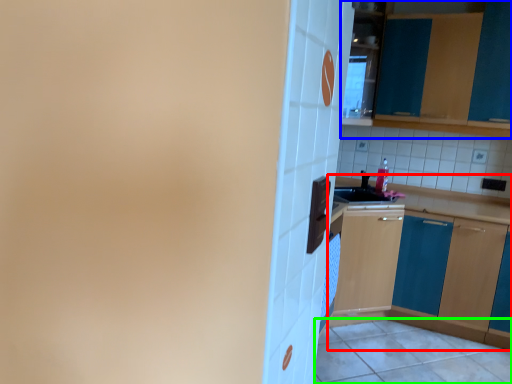
Question: Estimate the real-world distances between objects in this image. Which object is closer to cabinetry (highlighted by a red box), cabinetry (highlighted by a blue box) or tile (highlighted by a green box)?

Choices:
 (A) cabinetry
 (B) tile

Answer: (B)